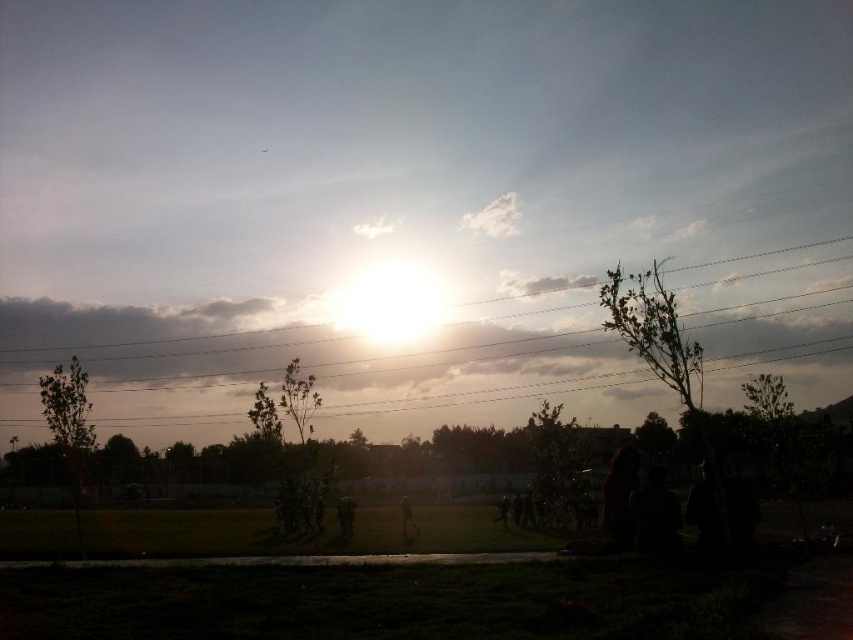
Does metallic wires at upper center have a greater width compared to green leafy tree at center?

Indeed, metallic wires at upper center has a greater width compared to green leafy tree at center.

Which is above, metallic wires at upper center or green leafy tree at center?

metallic wires at upper center is higher up.

Image resolution: width=853 pixels, height=640 pixels. I want to click on metallic wires at upper center, so click(x=331, y=372).